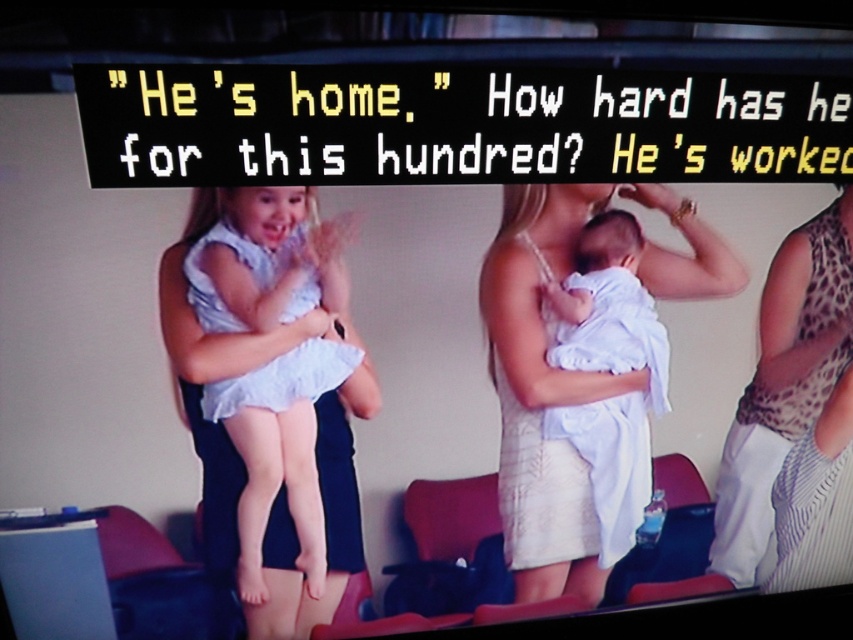
Based on the photo, you are a photographer standing in front of the scene. You need to capture a photo that includes both the white lace dress at center and the leopard print dress at right. If your camera has a maximum focus range of 9 inches, will you be able to capture both dresses in focus?

The distance between the white lace dress at center and the leopard print dress at right is 9.42 inches. Since this exceeds the camera maximum focus range of 9 inches, the photographer cannot capture both dresses in focus.

You are a photographer trying to capture a photo of both the leopard print dress at right and the white clothed baby at center. Which one should you focus on first to ensure both are in focus?

The leopard print dress at right is closer to you than the white clothed baby at center, so you should focus on the leopard print dress at right first to ensure both are in focus.